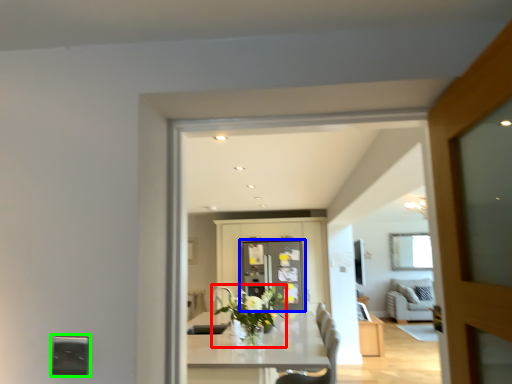
Question: Which is farther away from plant (highlighted by a red box)? screen door (highlighted by a blue box) or electric outlet (highlighted by a green box)?

Choices:
 (A) screen door
 (B) electric outlet

Answer: (B)